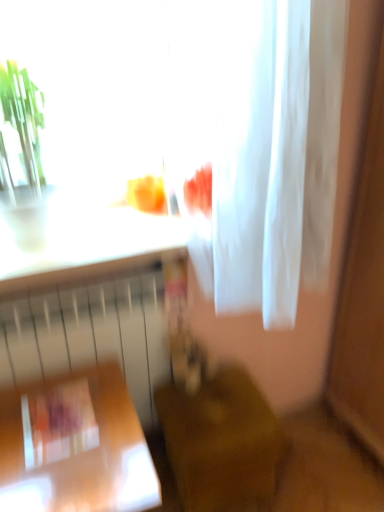
Image resolution: width=384 pixels, height=512 pixels. What are the coordinates of `free location in front of matte plastic book at lower left` in the screenshot? It's located at (52, 474).